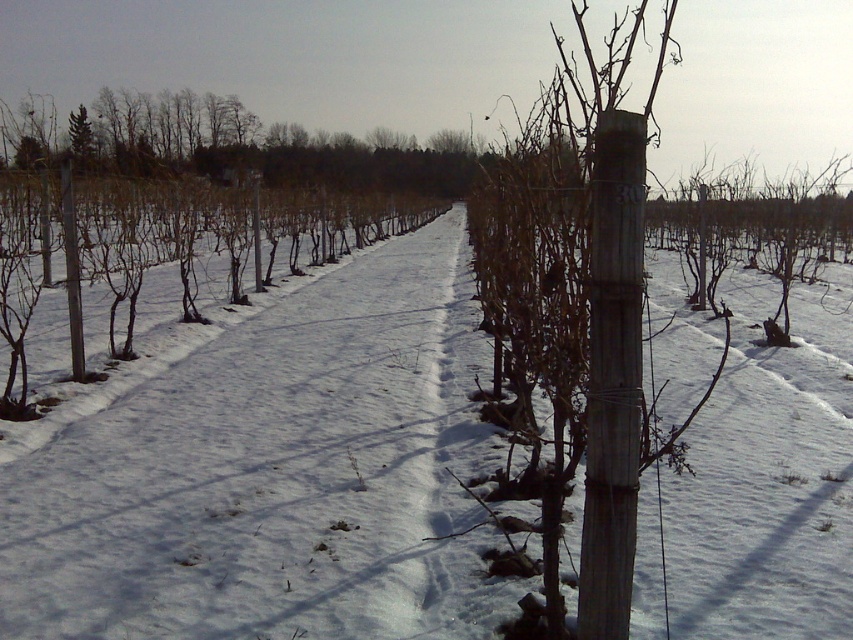
Based on the photo, you are a farmer checking the vineyard for potential snow damage. You notice the white powdery snow at center and the wooden post at center. Which object is wider in this scene?

The white powdery snow at center might be wider than wooden post at center according to the description.

You are standing in the snowy vineyard and want to walk from the wooden post at center to the gray wooden post at left. Which direction should you move to reach it?

To reach the gray wooden post at left from the wooden post at center, you should move upward since the gray wooden post at left is above the wooden post at center.